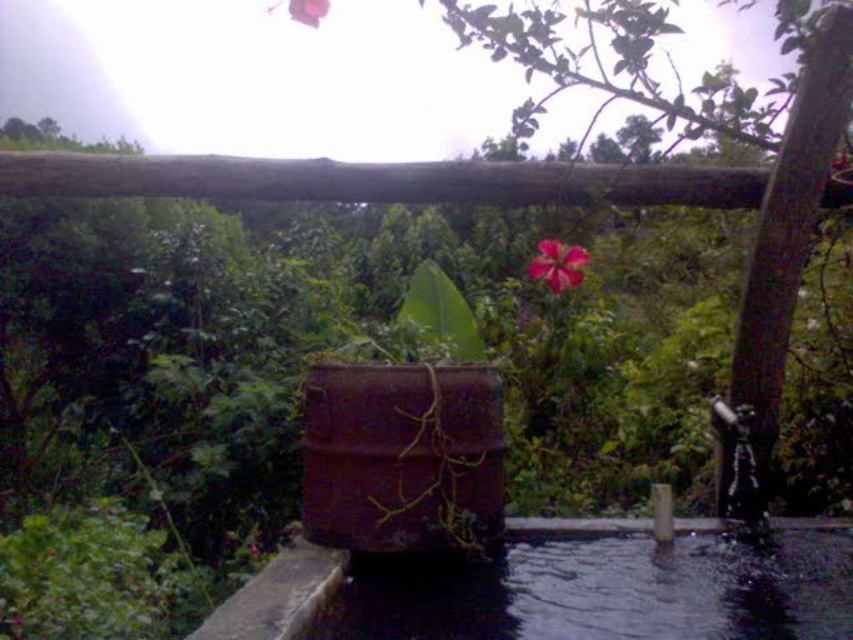
You are standing on a balcony and notice the clear water at bottom and the pink matte flower at upper center. Which object is closer to you from your viewpoint?

The clear water at bottom is closer to you because it is in front of the pink matte flower at upper center.

You are a painter standing on a balcony. You want to paint the clear water at bottom and the pink matte flower at upper center. Which object is taller in the scene?

The pink matte flower at upper center is taller than the clear water at bottom.

You are standing on a balcony and see the pink matte flower at upper center and the clear water at bottom. Which object is located to the right of the other?

The clear water at bottom is to the right of the pink matte flower at upper center.